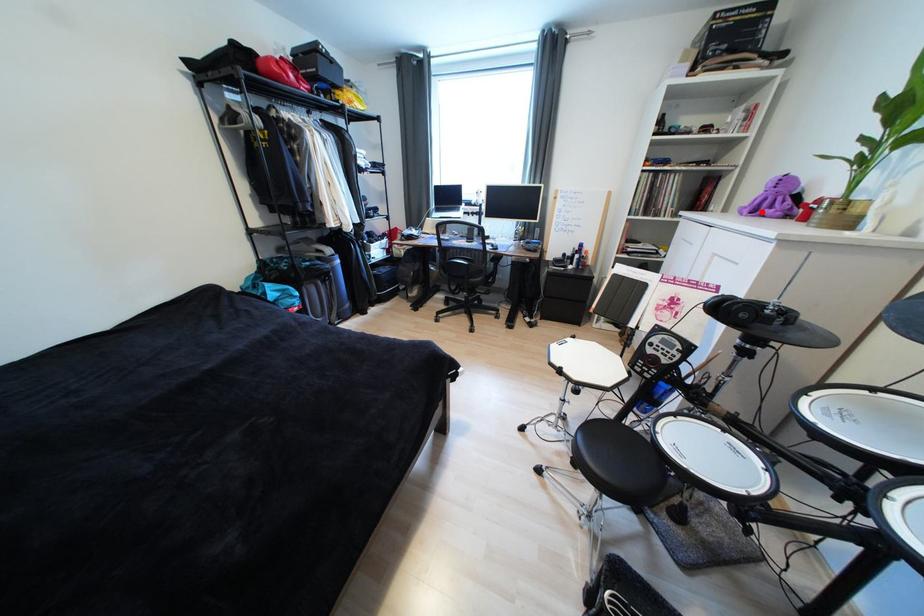
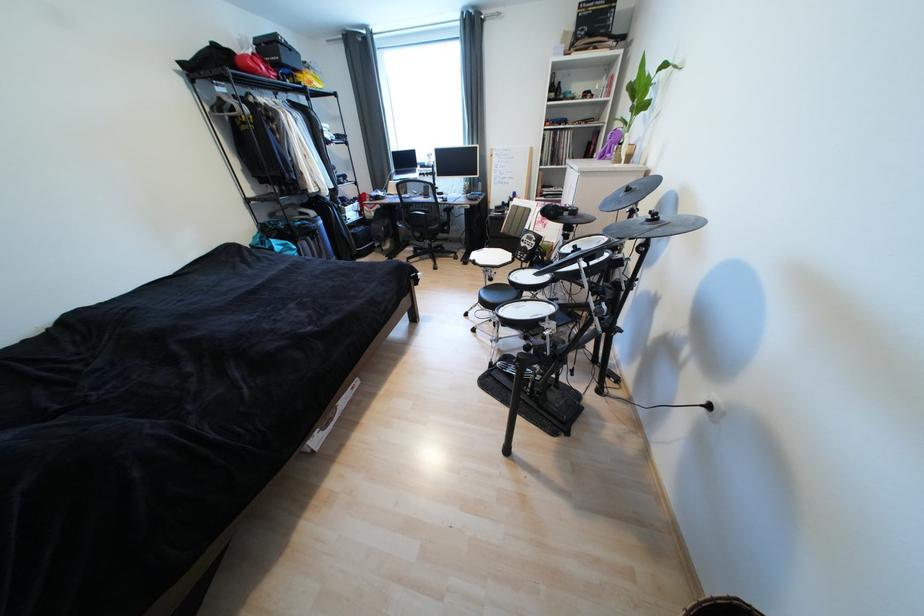
Find the pixel in the second image that matches the highlighted location in the first image.

(609, 156)